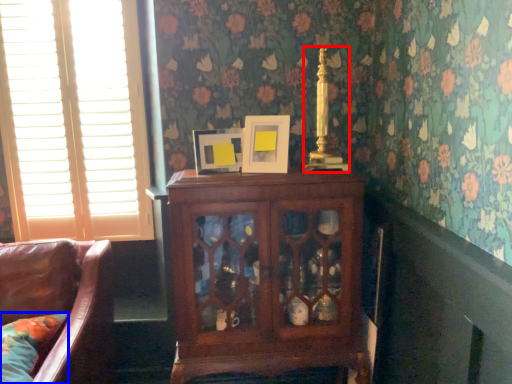
Question: Which object appears farthest to the camera in this image, candle holder (highlighted by a red box) or pillow (highlighted by a blue box)?

Choices:
 (A) candle holder
 (B) pillow

Answer: (A)